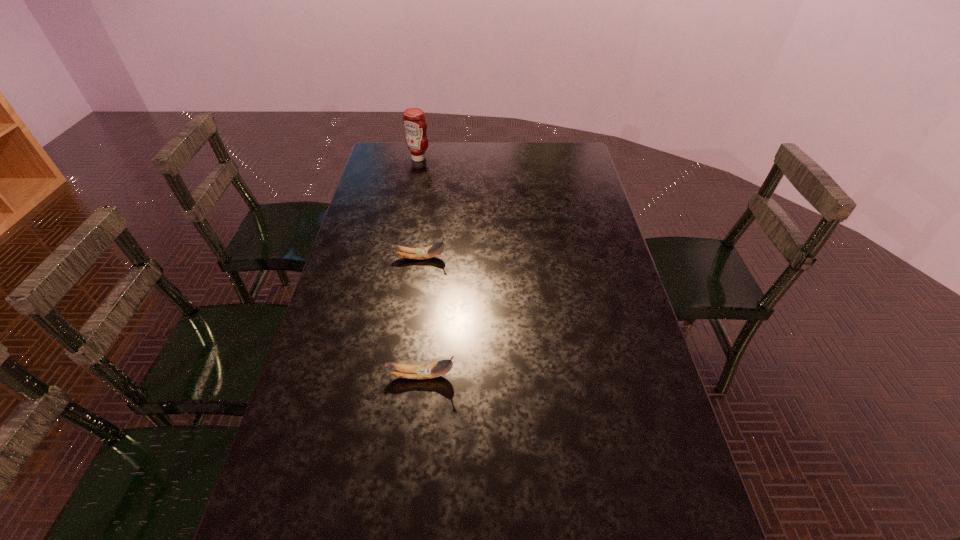
You are a GUI agent. You are given a task and a screenshot of the screen. Output one action in this format:
    pyautogui.click(x=<x>, y=<y>)
    Task: Click on the vacant region at the far edge of the desktop
    
    Given the screenshot: What is the action you would take?
    pyautogui.click(x=528, y=157)

You are a GUI agent. You are given a task and a screenshot of the screen. Output one action in this format:
    pyautogui.click(x=<x>, y=<y>)
    Task: Click on the free region at the left edge of the desktop
    Image resolution: width=960 pixels, height=540 pixels.
    Given the screenshot: What is the action you would take?
    pyautogui.click(x=391, y=200)

What are the coordinates of `free space at the right edge of the desktop` in the screenshot? It's located at (565, 180).

The height and width of the screenshot is (540, 960). In order to click on vacant space at the far right corner of the desktop in this screenshot , I will do `click(555, 171)`.

Identify the location of free point between the nearest object and the condiment. The width and height of the screenshot is (960, 540). (420, 267).

Image resolution: width=960 pixels, height=540 pixels. What are the coordinates of `vacant area that lies between the second farthest object and the condiment` in the screenshot? It's located at 420,208.

Where is `free spot between the tallest object and the nearer banana`? This screenshot has width=960, height=540. free spot between the tallest object and the nearer banana is located at coordinates (420, 267).

Find the location of a particular element. vacant area that lies between the farther banana and the nearest object is located at coordinates (420, 316).

Where is `free space between the nearer banana and the second nearest object`? Image resolution: width=960 pixels, height=540 pixels. free space between the nearer banana and the second nearest object is located at coordinates (420, 316).

At what (x,y) coordinates should I click in order to perform the action: click on vacant space that's between the farthest object and the second farthest object. Please return your answer as a coordinate pair (x, y). The height and width of the screenshot is (540, 960). Looking at the image, I should click on (420, 208).